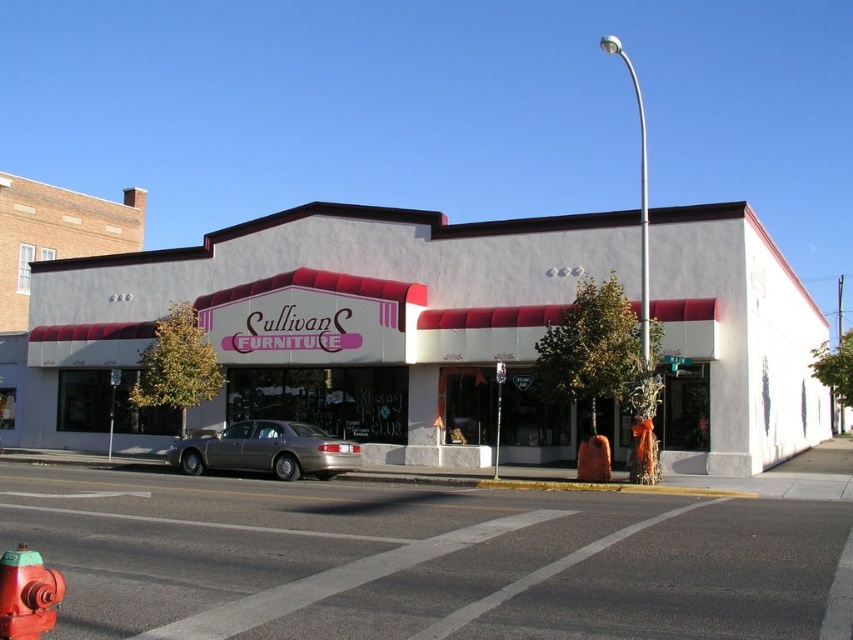
Does smooth asphalt road at center appear over red painted metal fire hydrant at lower left?

No.

Does smooth asphalt road at center have a larger size compared to red painted metal fire hydrant at lower left?

Correct, smooth asphalt road at center is larger in size than red painted metal fire hydrant at lower left.

The height and width of the screenshot is (640, 853). I want to click on smooth asphalt road at center, so click(x=418, y=561).

Does point (466, 305) come closer to viewer compared to point (544, 566)?

No, (466, 305) is behind (544, 566).

Does white matte building at center have a greater height compared to smooth asphalt road at center?

Indeed, white matte building at center has a greater height compared to smooth asphalt road at center.

What do you see at coordinates (329, 328) in the screenshot? The width and height of the screenshot is (853, 640). I see `white matte building at center` at bounding box center [329, 328].

I want to click on white matte building at center, so click(x=329, y=328).

Does smooth asphalt road at center have a greater width compared to gold metallic sedan at center?

Indeed, smooth asphalt road at center has a greater width compared to gold metallic sedan at center.

Which is behind, point (723, 508) or point (325, 460)?

Positioned behind is point (325, 460).

At what (x,y) coordinates should I click in order to perform the action: click on smooth asphalt road at center. Please return your answer as a coordinate pair (x, y). Looking at the image, I should click on (418, 561).

Find the location of a particular element. The height and width of the screenshot is (640, 853). smooth asphalt road at center is located at coordinates (418, 561).